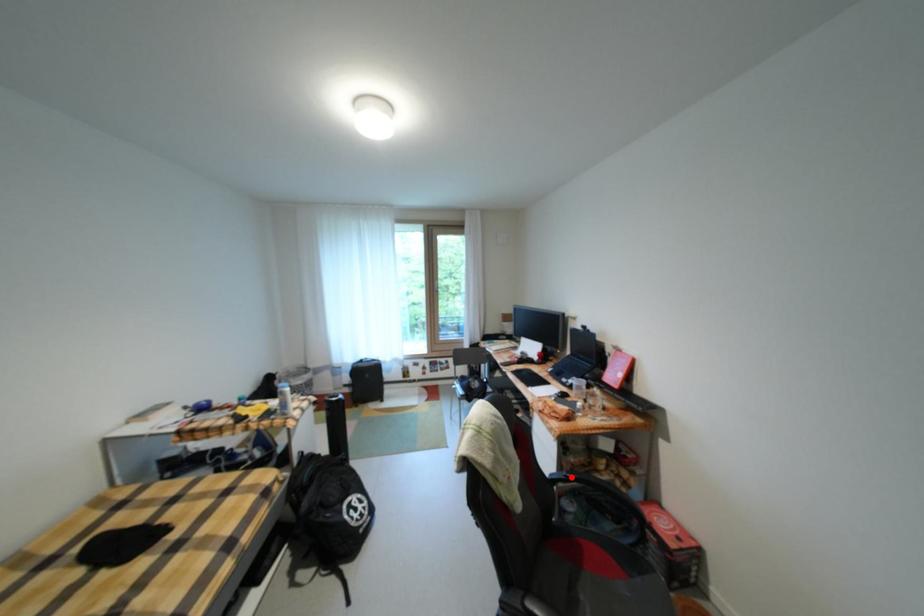
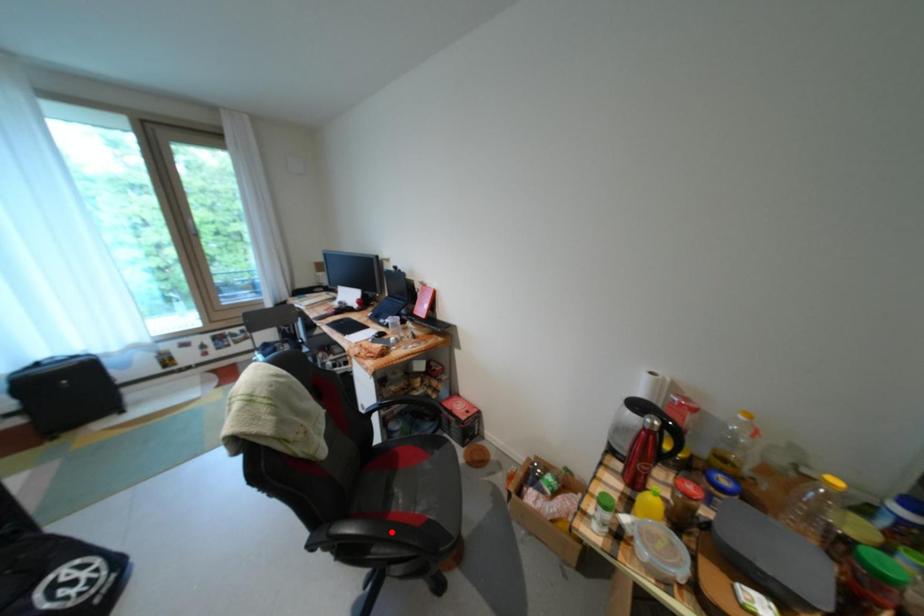
I am providing you with two images of the same scene from different viewpoints. A red point is marked on the first image and another point is marked on the second image. Do the highlighted points in image1 and image2 indicate the same real-world spot?

No